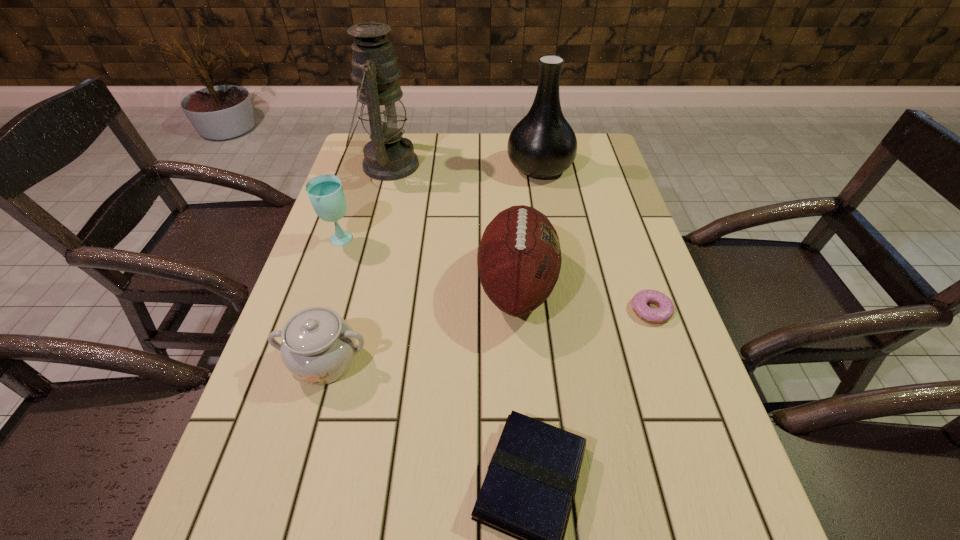
Find the location of a particular element. object present at the far left corner is located at coordinates (388, 156).

You are a GUI agent. You are given a task and a screenshot of the screen. Output one action in this format:
    pyautogui.click(x=<x>, y=<y>)
    Task: Click on the object situated at the far right corner
    The height and width of the screenshot is (540, 960).
    Given the screenshot: What is the action you would take?
    pyautogui.click(x=543, y=144)

Locate an element on the screen. This screenshot has width=960, height=540. vacant area at the far edge is located at coordinates (447, 159).

This screenshot has width=960, height=540. In order to click on vacant region at the left edge of the desktop in this screenshot , I will do click(251, 458).

Image resolution: width=960 pixels, height=540 pixels. What are the coordinates of `vacant region at the right edge` in the screenshot? It's located at (661, 386).

At what (x,y) coordinates should I click in order to perform the action: click on free area in between the tallest object and the vase. Please return your answer as a coordinate pair (x, y). The image size is (960, 540). Looking at the image, I should click on (464, 166).

Where is `unoccupied area between the chinaware and the oil lamp`? unoccupied area between the chinaware and the oil lamp is located at coordinates tap(357, 264).

Image resolution: width=960 pixels, height=540 pixels. I want to click on free space between the shortest object and the football (American), so click(584, 298).

At what (x,y) coordinates should I click in order to perform the action: click on vacant area between the rightmost object and the fifth tallest object. Please return your answer as a coordinate pair (x, y). The image size is (960, 540). Looking at the image, I should click on (489, 336).

This screenshot has height=540, width=960. I want to click on blank region between the glass and the chinaware, so click(333, 301).